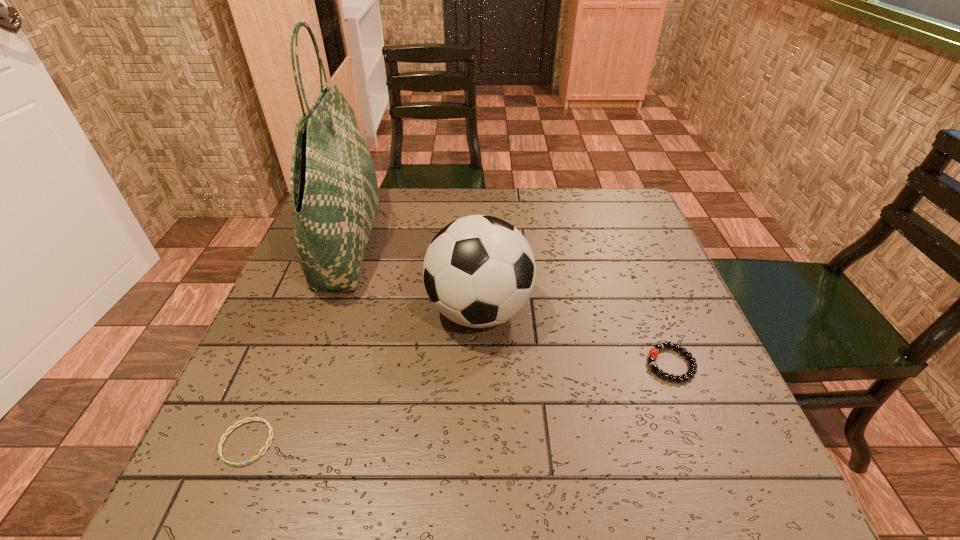
Find the location of a particular element. free region at the right edge is located at coordinates tap(636, 315).

This screenshot has height=540, width=960. In order to click on vacant space at the far left corner in this screenshot , I will do `click(381, 187)`.

In the image, there is a desktop. Where is `vacant space at the near left corner`? This screenshot has width=960, height=540. vacant space at the near left corner is located at coordinates (279, 462).

In the image, there is a desktop. Identify the location of free space at the far right corner. (596, 189).

The image size is (960, 540). Find the location of `free spot between the third tallest object and the third shortest object`. free spot between the third tallest object and the third shortest object is located at coordinates (575, 338).

Identify the location of empty location between the soccer ball and the shortest object. (364, 376).

Where is `vacant region between the second tallest object and the left bracelet`? This screenshot has width=960, height=540. vacant region between the second tallest object and the left bracelet is located at coordinates (364, 376).

Image resolution: width=960 pixels, height=540 pixels. I want to click on empty space between the third tallest object and the soccer ball, so click(x=575, y=338).

Locate which object is the third closest to the shorter bracelet. Please provide its 2D coordinates. Your answer should be formatted as a tuple, i.e. [(x, y)], where the tuple contains the x and y coordinates of a point satisfying the conditions above.

[(653, 353)]

Select which object is the third closest to the second shortest object. Please provide its 2D coordinates. Your answer should be formatted as a tuple, i.e. [(x, y)], where the tuple contains the x and y coordinates of a point satisfying the conditions above.

[(254, 418)]